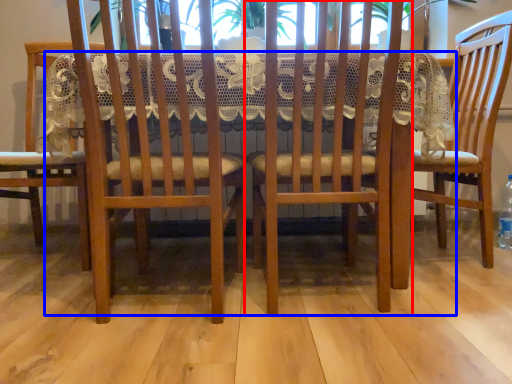
Question: Which of the following is the farthest to the observer, chair (highlighted by a red box) or table (highlighted by a blue box)?

Choices:
 (A) chair
 (B) table

Answer: (B)